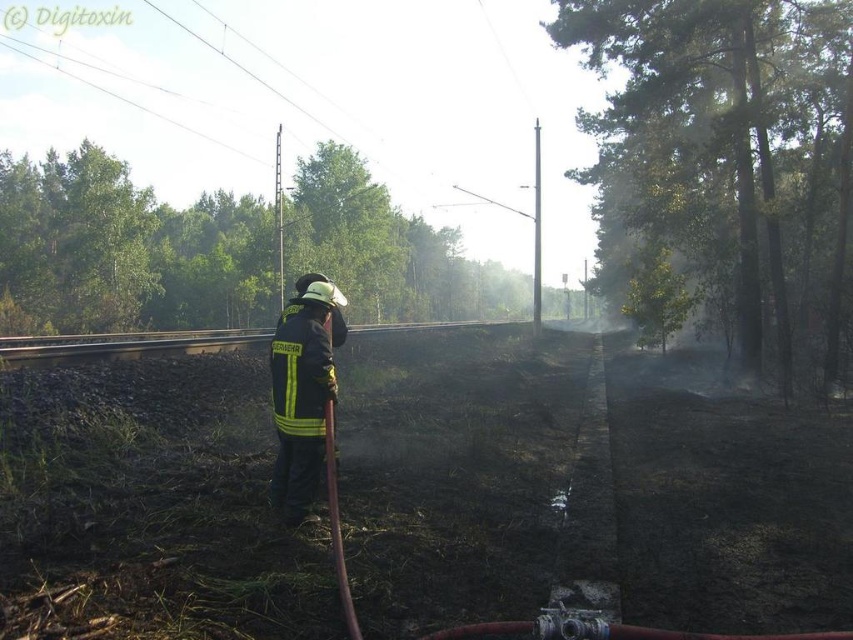
Who is more forward, (303, 410) or (329, 419)?

Point (329, 419)

Which is behind, point (306, 458) or point (325, 458)?

Positioned behind is point (325, 458).

Between point (312, 428) and point (329, 490), which one is positioned in front?

Point (329, 490) is more forward.

I want to click on black/yellow reflective uniform at center, so click(x=302, y=392).